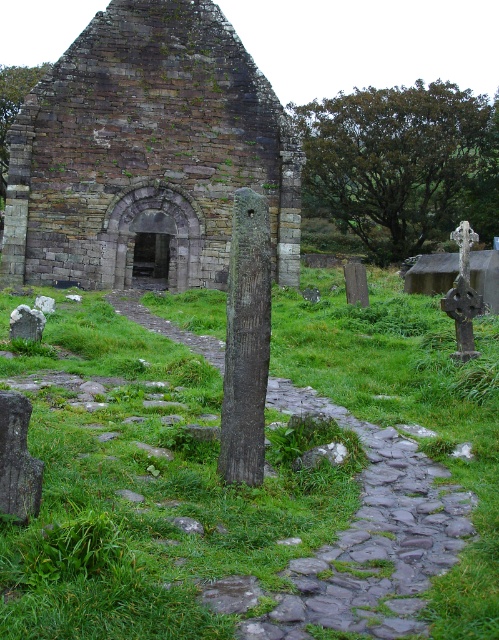
You are a traveler approaching the rustic stone church at center and the rough stone path at center. You need to walk through the path to reach the church. Is the path wide enough for you to walk comfortably without touching the sides?

The rustic stone church at center is wider than the rough stone path at center, so the path might be narrower than the church. Since the path is narrower, it may not provide enough space to walk comfortably without touching the sides.

In the scene shown: You are standing at the entrance of the rustic stone church at center. Looking at the coordinates provided, can you determine the direction you need to walk to reach the point marked at coordinates 0.244, 0.297?

The rustic stone church at center is already located at the coordinates [148,156], so you are already at the correct location.